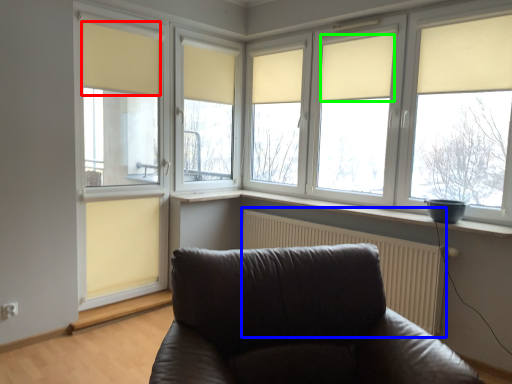
Question: Estimate the real-world distances between objects in this image. Which object is closer to curtain (highlighted by a red box), radiator (highlighted by a blue box) or curtain (highlighted by a green box)?

Choices:
 (A) radiator
 (B) curtain

Answer: (B)